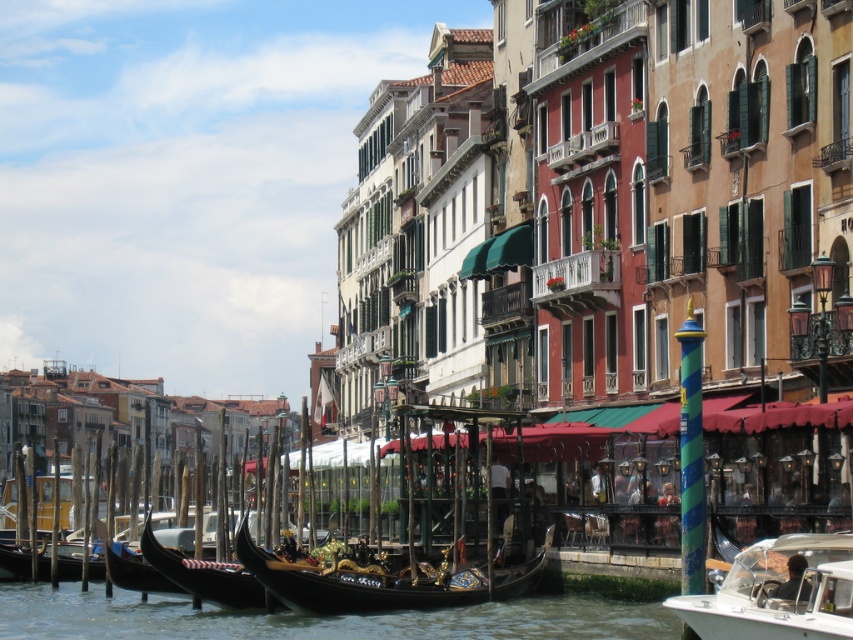
From the picture: You are a tourist standing on the canal bridge and want to take a photo of both the black polished gondola at center and the polished wood gondola at center. Which gondola should you focus on first to ensure both are in frame without moving the camera?

You should focus on the black polished gondola at center first since it is taller than the polished wood gondola at center, allowing you to adjust the camera angle to include both in the frame.